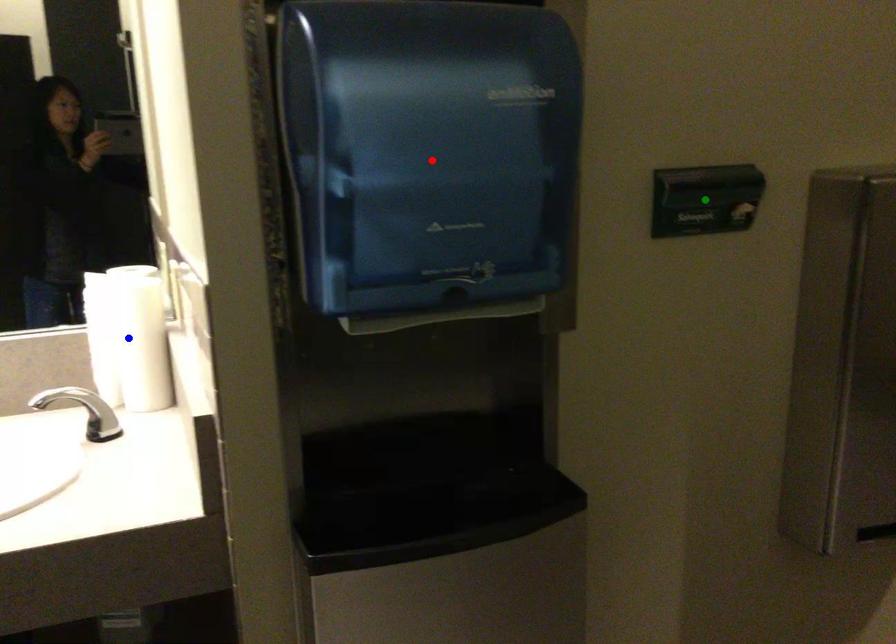
Order these from nearest to farthest:
blue point, green point, red point

red point, green point, blue point